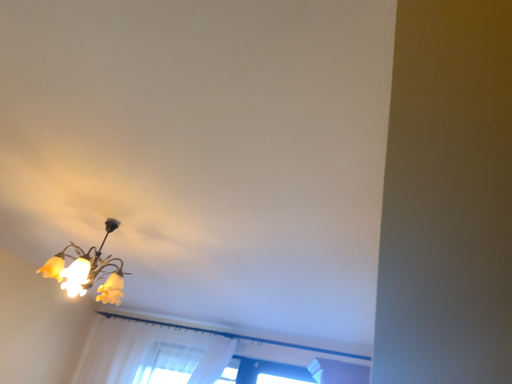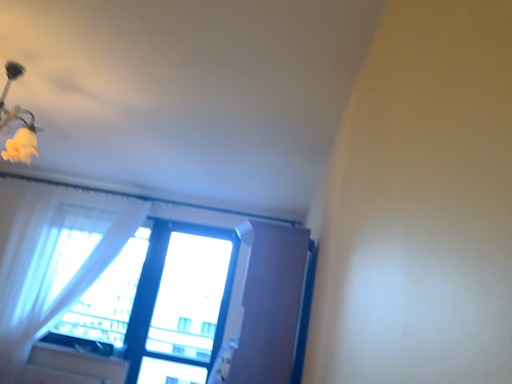
Question: How did the camera likely rotate when shooting the video?

Choices:
 (A) rotated upward
 (B) rotated downward

Answer: (B)